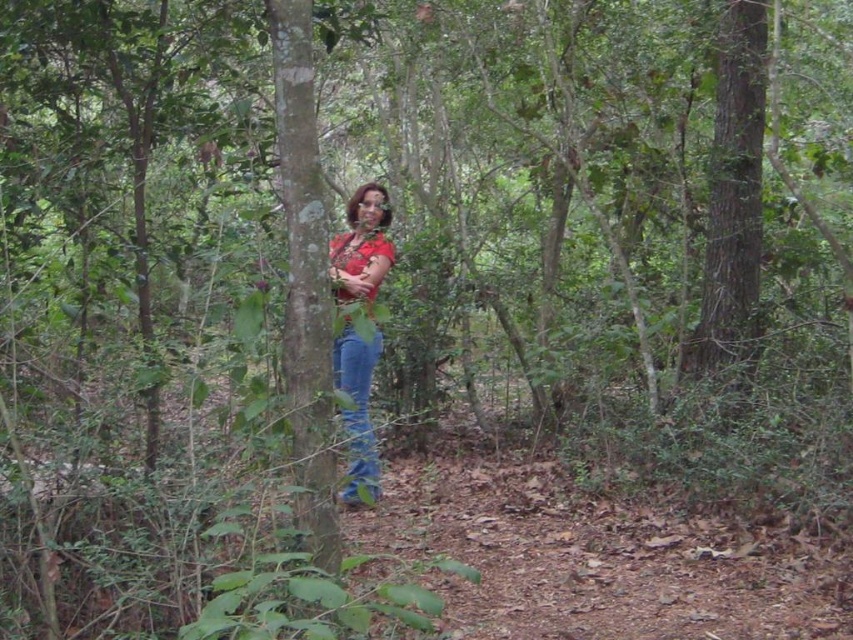
Is point (297, 268) closer to viewer compared to point (758, 291)?

Yes, point (297, 268) is closer to viewer.

Between point (318, 228) and point (733, 129), which one is positioned in front?

Point (318, 228)

Locate an element on the screen. This screenshot has height=640, width=853. smooth bark tree trunk at center is located at coordinates (305, 282).

Can you confirm if smooth bark tree trunk at center is wider than matte red shirt at center?

No, smooth bark tree trunk at center is not wider than matte red shirt at center.

Between smooth bark tree trunk at center and matte red shirt at center, which one appears on the left side from the viewer's perspective?

smooth bark tree trunk at center is more to the left.

Describe the element at coordinates (305, 282) in the screenshot. The height and width of the screenshot is (640, 853). I see `smooth bark tree trunk at center` at that location.

Identify the location of smooth bark tree trunk at center. Image resolution: width=853 pixels, height=640 pixels. (305, 282).

Is brown rough tree trunk at right bigger than matte red shirt at center?

Incorrect, brown rough tree trunk at right is not larger than matte red shirt at center.

The height and width of the screenshot is (640, 853). What are the coordinates of `brown rough tree trunk at right` in the screenshot? It's located at (732, 205).